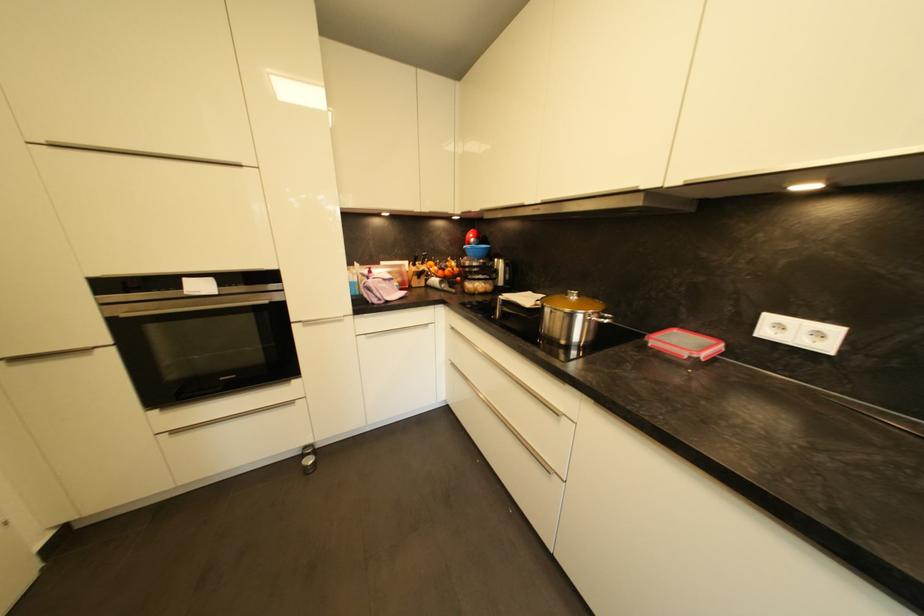
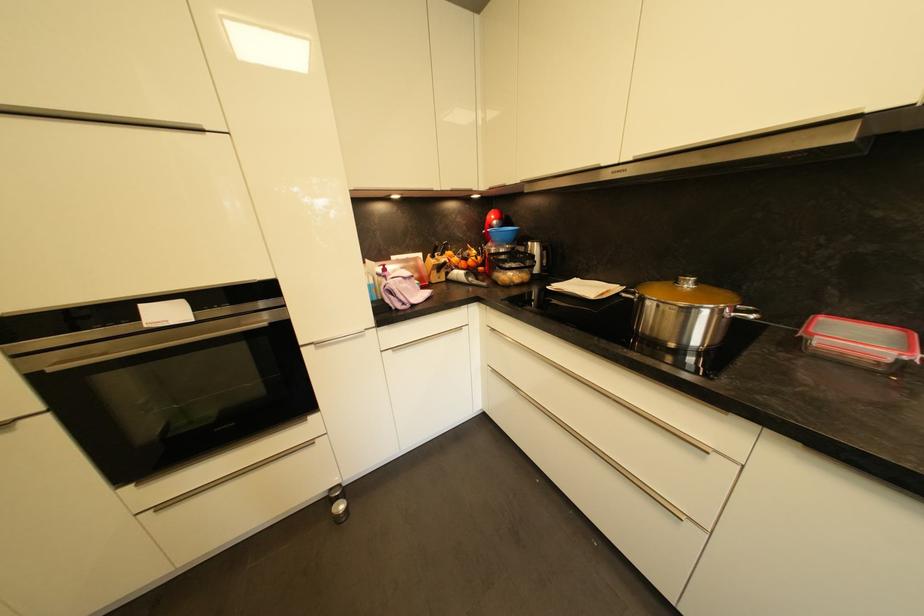
Where in the second image is the point corresponding to point 445,274 from the first image?

(468, 265)